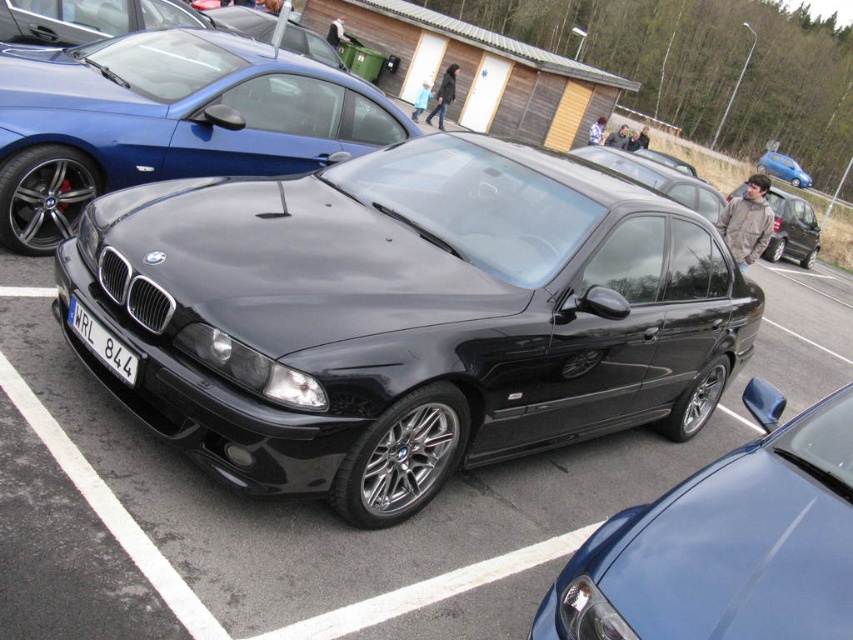
Is black metallic car at center positioned in front of metallic blue hatchback at upper right?

Yes, it is.

Does point (310, 440) lie behind point (759, 157)?

No, it is not.

Describe the element at coordinates (407, 316) in the screenshot. I see `black metallic car at center` at that location.

Find the location of a particular element. This screenshot has width=853, height=640. black metallic car at center is located at coordinates (407, 316).

Is black matte sedan at center behind metallic blue hatchback at upper right?

No, black matte sedan at center is in front of metallic blue hatchback at upper right.

Between black matte sedan at center and metallic blue hatchback at upper right, which one is positioned higher?

metallic blue hatchback at upper right is above.

Is point (787, 230) closer to camera compared to point (764, 150)?

Yes, it is.

What are the coordinates of `black matte sedan at center` in the screenshot? It's located at (791, 228).

Between point (622, 241) and point (97, 358), which one is positioned behind?

The point (622, 241) is behind.

Is black metallic car at center taller than white plastic license plate at center?

Correct, black metallic car at center is much taller as white plastic license plate at center.

The width and height of the screenshot is (853, 640). What do you see at coordinates (407, 316) in the screenshot? I see `black metallic car at center` at bounding box center [407, 316].

Identify the location of black metallic car at center. This screenshot has height=640, width=853. (407, 316).